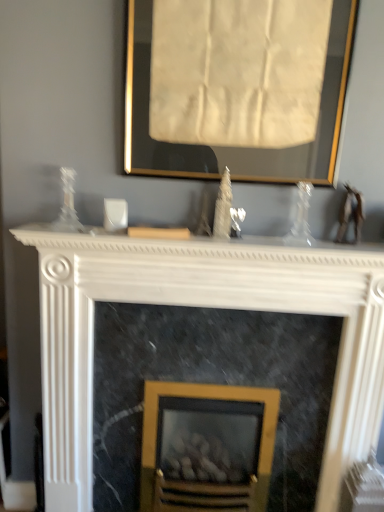
Question: Visually, is gold-framed fireplace at center, acting as the 1th fireplace starting from the back, positioned to the left or to the right of white marble fireplace at center, the 3th fireplace in the back-to-front sequence?

Choices:
 (A) right
 (B) left

Answer: (A)

Question: Considering their positions, is gold-framed fireplace at center, acting as the 1th fireplace starting from the back, located in front of or behind white marble fireplace at center, which is counted as the 1th fireplace, starting from the front?

Choices:
 (A) front
 (B) behind

Answer: (B)

Question: Which object is positioned farthest from the white marble fireplace at center?

Choices:
 (A) gold-framed fireplace at center, which appears as the 3th fireplace when viewed from the front
 (B) marble fireplace at center, acting as the second fireplace starting from the front
 (C) gold-framed artwork at upper center
 (D) white marble fireplace at center, which is counted as the 1th fireplace, starting from the front

Answer: (A)

Question: Which object is positioned closest to the marble fireplace at center, acting as the second fireplace starting from the front?

Choices:
 (A) white marble fireplace at center, the 3th fireplace in the back-to-front sequence
 (B) gold-framed fireplace at center, acting as the 1th fireplace starting from the back
 (C) white marble fireplace at center
 (D) gold-framed artwork at upper center

Answer: (B)